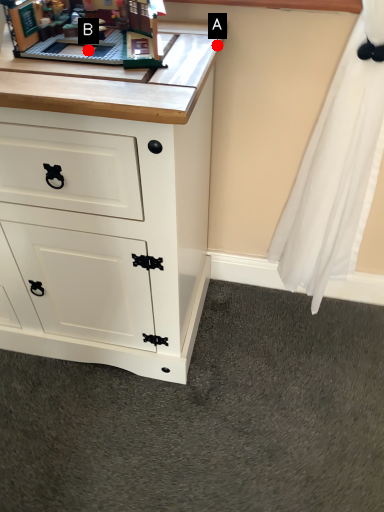
Question: Two points are circled on the image, labeled by A and B beside each circle. Which point is closer to the camera taking this photo?

Choices:
 (A) A is closer
 (B) B is closer

Answer: (B)